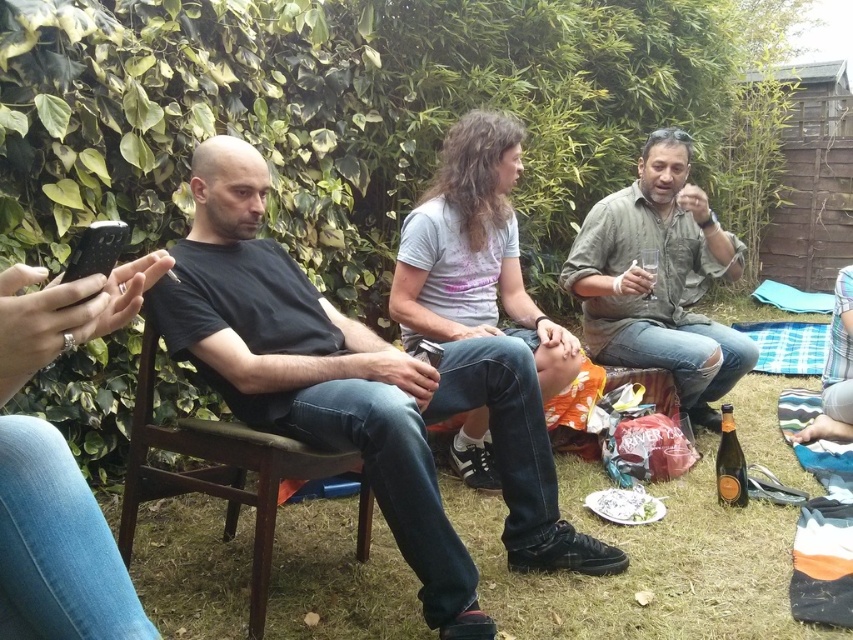
Locate an element on the screen. The image size is (853, 640). black matte t-shirt at left is located at coordinates (360, 392).

You are a GUI agent. You are given a task and a screenshot of the screen. Output one action in this format:
    pyautogui.click(x=<x>, y=<y>)
    Task: Click on the black matte t-shirt at left
    The width and height of the screenshot is (853, 640).
    Given the screenshot: What is the action you would take?
    pyautogui.click(x=360, y=392)

In the scene shown: Which of these two, matte brown shirt at center or white crumpled paper at lower center, stands shorter?

white crumpled paper at lower center is shorter.

This screenshot has height=640, width=853. In order to click on matte brown shirt at center in this screenshot , I will do `click(659, 280)`.

How far apart are matte brown shirt at center and brown wooden chair at center?

matte brown shirt at center is 1.51 meters away from brown wooden chair at center.

Who is positioned more to the left, matte brown shirt at center or brown wooden chair at center?

Positioned to the left is brown wooden chair at center.

Locate an element on the screen. This screenshot has width=853, height=640. matte brown shirt at center is located at coordinates (659, 280).